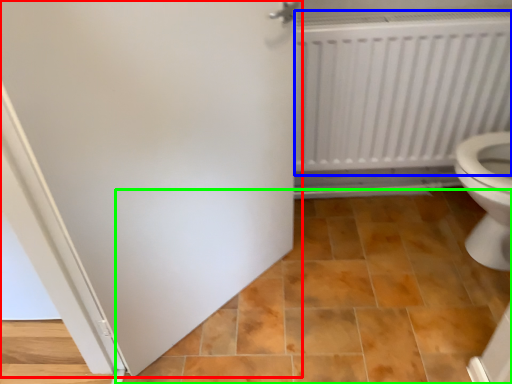
Question: Considering the real-world distances, which object is farthest from door (highlighted by a red box)? radiator (highlighted by a blue box) or ceramic tile (highlighted by a green box)?

Choices:
 (A) radiator
 (B) ceramic tile

Answer: (A)